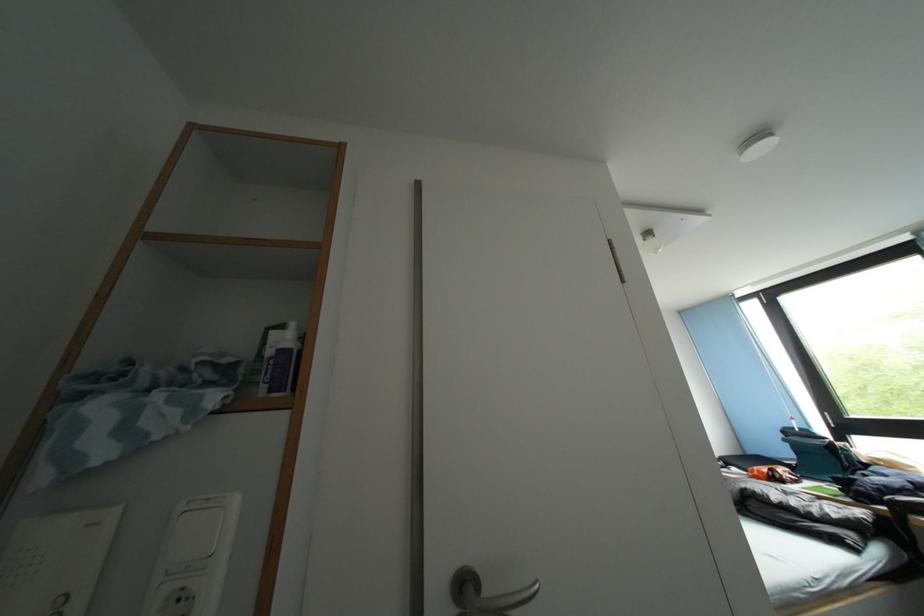
What are the coordinates of `white light switch` in the screenshot? It's located at (193, 557).